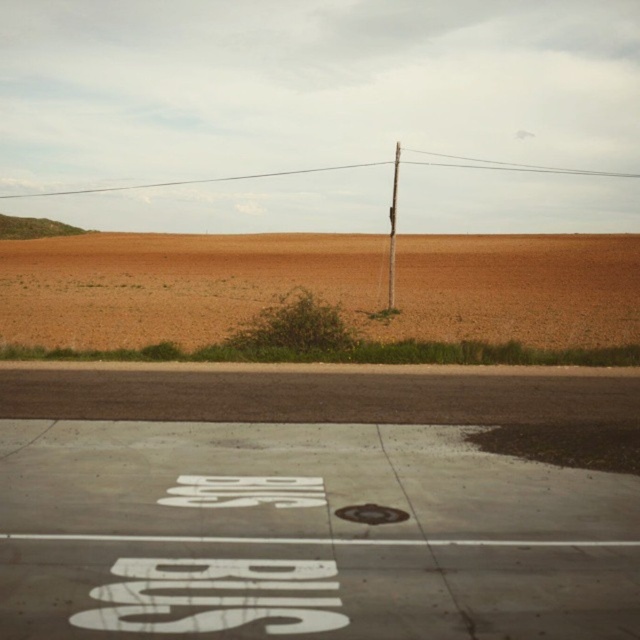
Question: Which object is farther from the camera taking this photo?

Choices:
 (A) white painted concrete at center
 (B) smooth wood pole at center
 (C) brown grassland at center

Answer: (B)

Question: Can you confirm if brown grassland at center is positioned to the left of smooth wood pole at center?

Choices:
 (A) yes
 (B) no

Answer: (A)

Question: Considering the real-world distances, which object is closest to the brown grassland at center?

Choices:
 (A) white painted concrete at center
 (B) smooth wood pole at center

Answer: (B)

Question: From the image, what is the correct spatial relationship of brown grassland at center in relation to smooth wood pole at center?

Choices:
 (A) below
 (B) above

Answer: (A)

Question: Among these objects, which one is nearest to the camera?

Choices:
 (A) white painted concrete at center
 (B) brown grassland at center
 (C) smooth wood pole at center

Answer: (A)

Question: Can you confirm if white painted concrete at center is wider than smooth wood pole at center?

Choices:
 (A) no
 (B) yes

Answer: (B)